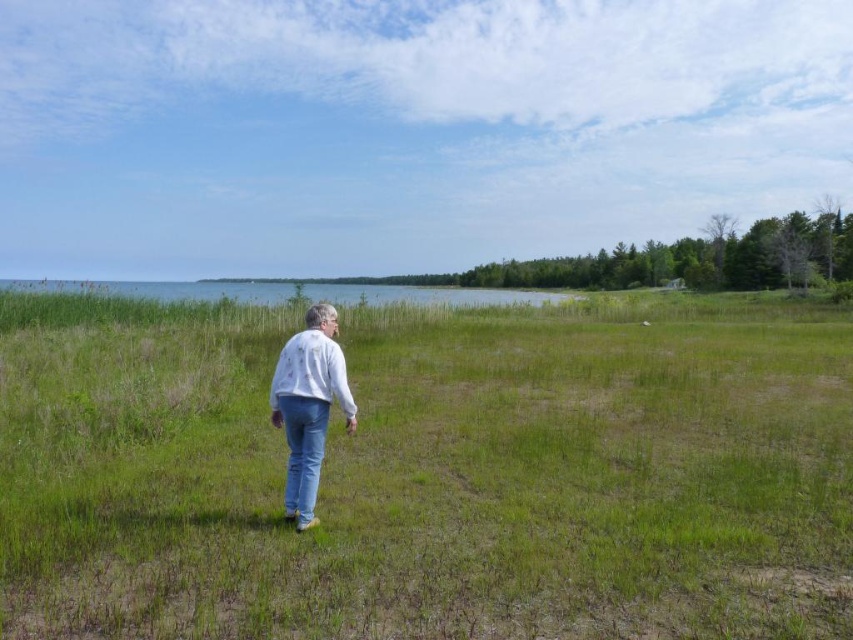
Question: Estimate the real-world distances between objects in this image. Which object is farther from the green grass at center?

Choices:
 (A) white cotton shirt at center
 (B) denim jeans at center

Answer: (A)

Question: Which of the following is the closest to the observer?

Choices:
 (A) denim jeans at center
 (B) green grass at center

Answer: (B)

Question: Can you confirm if green grass at center is smaller than denim jeans at center?

Choices:
 (A) yes
 (B) no

Answer: (B)

Question: Does green grass at center have a smaller size compared to denim jeans at center?

Choices:
 (A) no
 (B) yes

Answer: (A)

Question: Is green grass at center in front of white cotton shirt at center?

Choices:
 (A) no
 (B) yes

Answer: (B)

Question: Which point is farther from the camera taking this photo?

Choices:
 (A) (357, 358)
 (B) (285, 401)

Answer: (A)